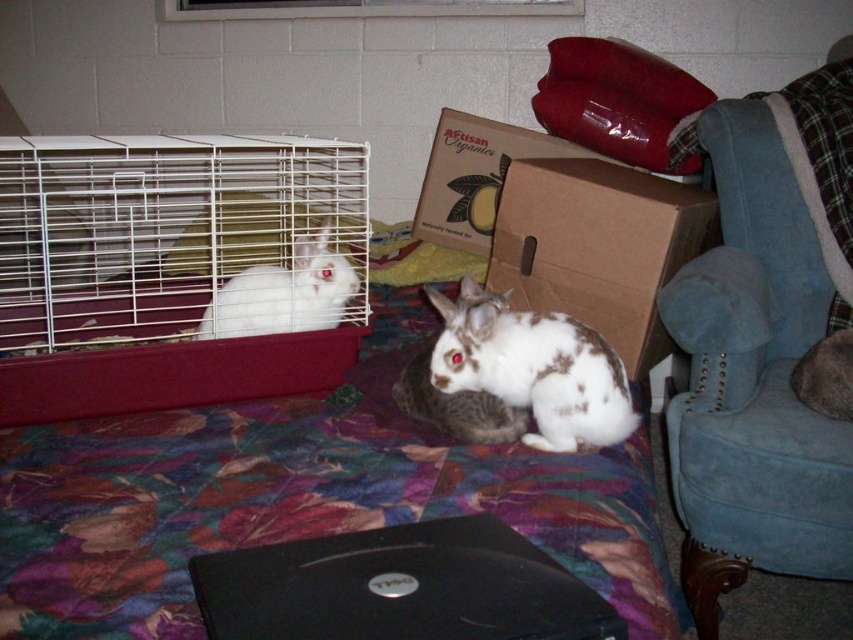
Is brown and white fur rabbit at center taller than cardboard box at upper center?

No, brown and white fur rabbit at center is not taller than cardboard box at upper center.

Measure the distance from brown and white fur rabbit at center to cardboard box at upper center.

36.21 inches

Which is behind, point (466, 387) or point (451, 113)?

Positioned behind is point (451, 113).

Identify the location of brown and white fur rabbit at center. (532, 369).

Who is positioned more to the right, brown cardboard box at center or cardboard box at upper center?

Positioned to the right is brown cardboard box at center.

Is brown cardboard box at center wider than cardboard box at upper center?

No.

What do you see at coordinates (598, 246) in the screenshot?
I see `brown cardboard box at center` at bounding box center [598, 246].

Find the location of a particular element. The height and width of the screenshot is (640, 853). brown cardboard box at center is located at coordinates (598, 246).

Which of these two, brown and white fur rabbit at center or white fur rabbit at left, stands taller?

brown and white fur rabbit at center

Which is in front, point (581, 376) or point (341, 289)?

Point (581, 376)

Identify the location of brown and white fur rabbit at center. This screenshot has width=853, height=640. (532, 369).